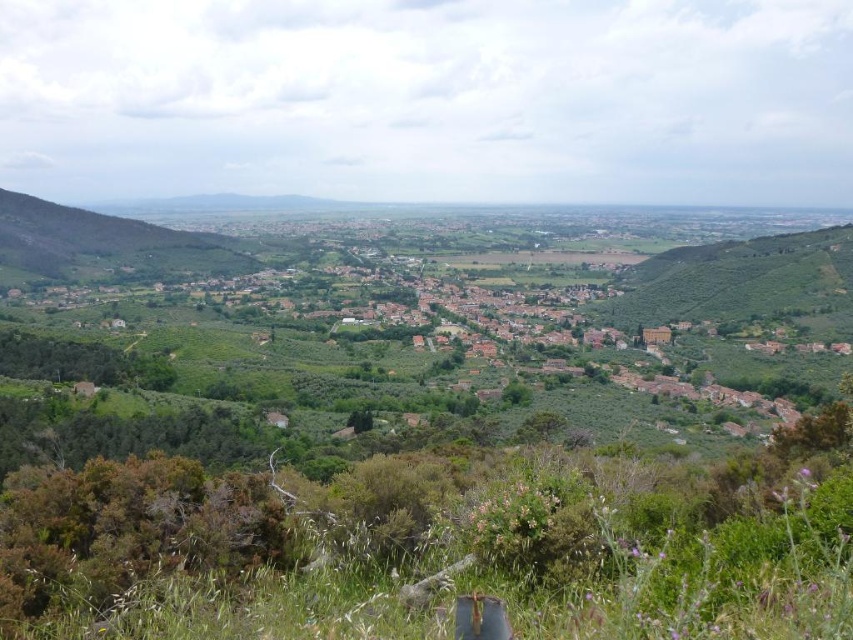
Question: Does green leafy grass at lower center appear under green leafy hillside at left?

Choices:
 (A) yes
 (B) no

Answer: (A)

Question: Is green leafy grass at lower center positioned behind green leafy hillside at left?

Choices:
 (A) yes
 (B) no

Answer: (B)

Question: Among these points, which one is nearest to the camera?

Choices:
 (A) (26, 227)
 (B) (660, 589)

Answer: (B)

Question: Which of the following is the farthest from the observer?

Choices:
 (A) (70, 234)
 (B) (210, 524)

Answer: (A)

Question: Is green leafy grass at lower center further to the viewer compared to green leafy hillside at left?

Choices:
 (A) yes
 (B) no

Answer: (B)